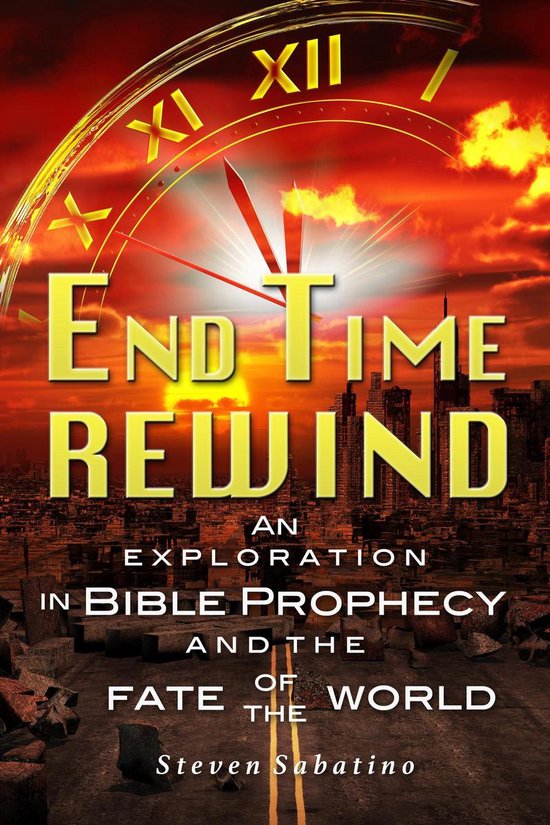
The width and height of the screenshot is (550, 825). What are the coordinates of `clock` in the screenshot? It's located at (280, 149).